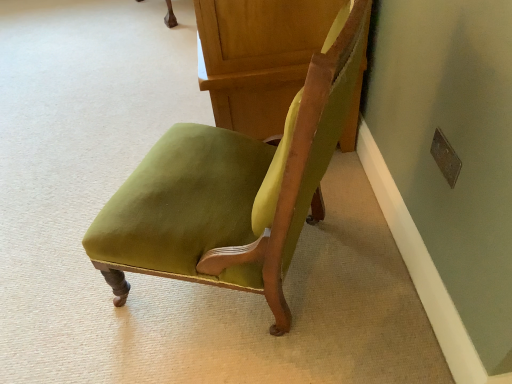
Question: Should I look upward or downward to see velvet green chair at center?

Choices:
 (A) up
 (B) down

Answer: (A)

Question: Can you confirm if velvet green chair at center is thinner than velvet green chair at center?

Choices:
 (A) yes
 (B) no

Answer: (A)

Question: Considering the relative positions of velvet green chair at center and velvet green chair at center in the image provided, is velvet green chair at center to the left of velvet green chair at center from the viewer's perspective?

Choices:
 (A) no
 (B) yes

Answer: (A)

Question: From a real-world perspective, is velvet green chair at center beneath velvet green chair at center?

Choices:
 (A) yes
 (B) no

Answer: (A)

Question: Does velvet green chair at center turn towards velvet green chair at center?

Choices:
 (A) yes
 (B) no

Answer: (B)

Question: Can you confirm if velvet green chair at center is taller than velvet green chair at center?

Choices:
 (A) yes
 (B) no

Answer: (B)

Question: From the image's perspective, is velvet green chair at center below velvet green chair at center?

Choices:
 (A) yes
 (B) no

Answer: (B)

Question: Is velvet green chair at center facing away from velvet green chair at center?

Choices:
 (A) yes
 (B) no

Answer: (B)

Question: Is velvet green chair at center located outside velvet green chair at center?

Choices:
 (A) yes
 (B) no

Answer: (A)

Question: Can you confirm if velvet green chair at center is shorter than velvet green chair at center?

Choices:
 (A) no
 (B) yes

Answer: (A)

Question: Does velvet green chair at center appear on the right side of velvet green chair at center?

Choices:
 (A) no
 (B) yes

Answer: (A)

Question: Does velvet green chair at center contain velvet green chair at center?

Choices:
 (A) no
 (B) yes

Answer: (A)

Question: From the image's perspective, would you say velvet green chair at center is shown under velvet green chair at center?

Choices:
 (A) no
 (B) yes

Answer: (B)

Question: From a real-world perspective, is velvet green chair at center above or below velvet green chair at center?

Choices:
 (A) below
 (B) above

Answer: (B)